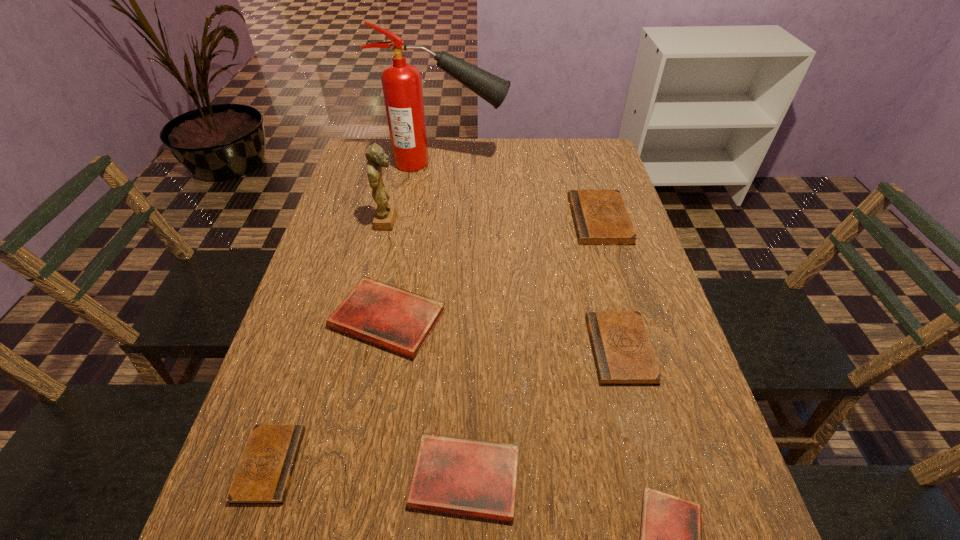
At what (x,y) coordinates should I click in order to perform the action: click on free area in between the farthest brown diary and the farthest object. Please return your answer as a coordinate pair (x, y). The height and width of the screenshot is (540, 960). Looking at the image, I should click on click(x=522, y=191).

You are a GUI agent. You are given a task and a screenshot of the screen. Output one action in this format:
    pyautogui.click(x=<x>, y=<y>)
    Task: Click on the blank region between the figurine and the second biggest brown diary
    The width and height of the screenshot is (960, 540).
    Given the screenshot: What is the action you would take?
    pyautogui.click(x=504, y=285)

The image size is (960, 540). I want to click on free area in between the second tallest object and the second biggest red diary, so click(x=426, y=349).

Identify which object is located as the fifth nearest to the second smallest brown diary. Please provide its 2D coordinates. Your answer should be formatted as a tuple, i.e. [(x, y)], where the tuple contains the x and y coordinates of a point satisfying the conditions above.

[(385, 215)]

Identify which object is the nearest to the smallest brown diary. Please provide its 2D coordinates. Your answer should be formatted as a tuple, i.e. [(x, y)], where the tuple contains the x and y coordinates of a point satisfying the conditions above.

[(385, 315)]

Select which diary is the fifth closest to the sixth shortest object. Please provide its 2D coordinates. Your answer should be formatted as a tuple, i.e. [(x, y)], where the tuple contains the x and y coordinates of a point satisfying the conditions above.

[(263, 477)]

Find the location of a particular element. The image size is (960, 540). diary that is the closest to the biggest red diary is located at coordinates (263, 477).

At what (x,y) coordinates should I click in order to perform the action: click on brown diary that is the closest to the shortest diary. Please return your answer as a coordinate pair (x, y). The height and width of the screenshot is (540, 960). Looking at the image, I should click on (623, 355).

Point out which brown diary is positioned as the third nearest to the figurine. Please provide its 2D coordinates. Your answer should be formatted as a tuple, i.e. [(x, y)], where the tuple contains the x and y coordinates of a point satisfying the conditions above.

[(263, 477)]

In order to click on red diary that is the second closest to the biggest red diary in this screenshot , I will do `click(670, 530)`.